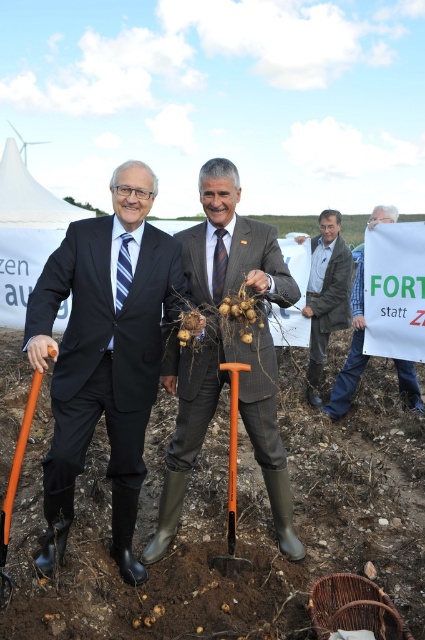
Is matte gray suit at center thinner than leather jacket at center?

Incorrect, matte gray suit at center's width is not less than leather jacket at center's.

Which of these two, matte gray suit at center or leather jacket at center, stands taller?

Standing taller between the two is matte gray suit at center.

At what (x,y) coordinates should I click in order to perform the action: click on matte gray suit at center. Please return your answer as a coordinate pair (x, y). Image resolution: width=425 pixels, height=640 pixels. Looking at the image, I should click on (210, 419).

Can you confirm if black suit at center is shorter than matte gray suit at center?

Yes.

Which is below, black suit at center or matte gray suit at center?

black suit at center is lower down.

Who is more forward, (84, 269) or (241, 355)?

Point (84, 269) is in front.

The image size is (425, 640). I want to click on black suit at center, so click(104, 353).

Is black suit at center closer to camera compared to denim jacket at center?

Yes, it is.

Is black suit at center further to the viewer compared to denim jacket at center?

No, it is in front of denim jacket at center.

Does point (108, 467) come farther from viewer compared to point (359, 356)?

No, (108, 467) is closer to viewer.

This screenshot has height=640, width=425. In order to click on black suit at center in this screenshot , I will do `click(104, 353)`.